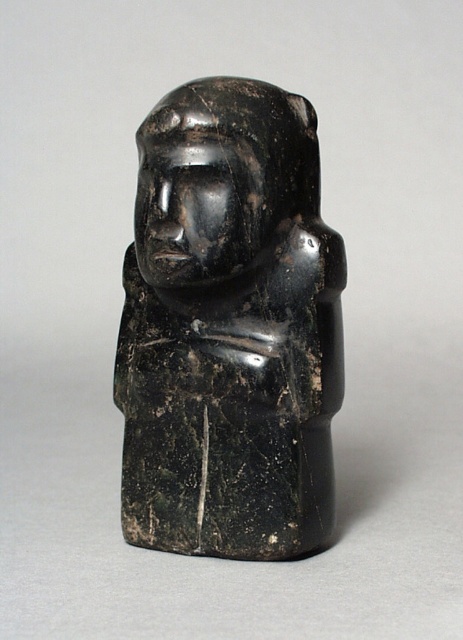
Does black stone figure at center have a larger size compared to black stone head at center?

Yes.

Is point (213, 170) behind point (200, 220)?

Yes.

Is point (264, 376) positioned after point (312, 116)?

No, it is in front of (312, 116).

Locate an element on the screen. black stone figure at center is located at coordinates (230, 326).